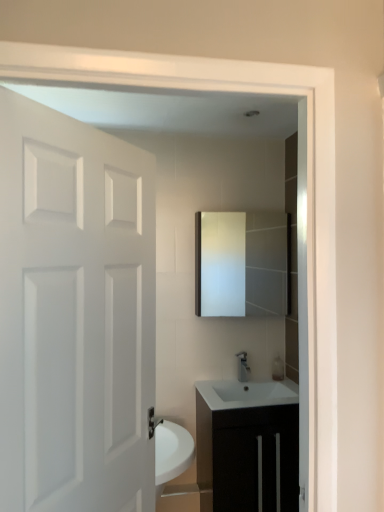
Question: In the image, is white matte door at left on the left side or the right side of matte white mirror at center?

Choices:
 (A) right
 (B) left

Answer: (B)

Question: Do you think white matte door at left is within matte white mirror at center, or outside of it?

Choices:
 (A) inside
 (B) outside

Answer: (B)

Question: Which object is positioned closest to the matte white mirror at center?

Choices:
 (A) black matte cabinet at lower center
 (B) satin nickel faucet at center
 (C) white matte door at left

Answer: (B)

Question: Which is nearer to the matte white mirror at center?

Choices:
 (A) black matte cabinet at lower center
 (B) satin nickel faucet at center
 (C) white matte door at left

Answer: (B)